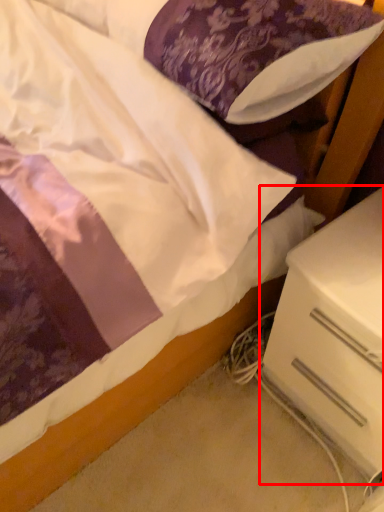
Question: In this image, where is nightstand (annotated by the red box) located relative to pillow?

Choices:
 (A) left
 (B) right

Answer: (B)